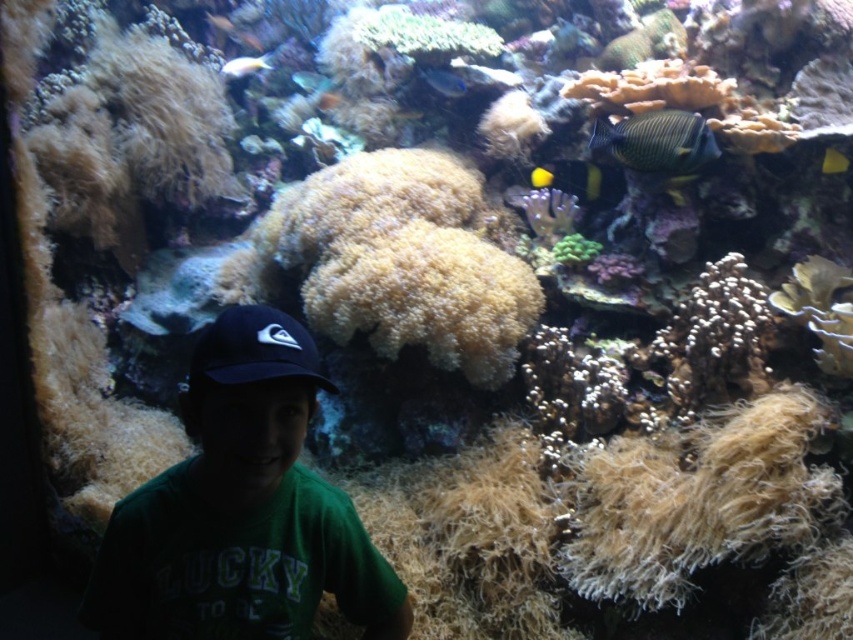
Between white soft coral at upper center and blue glossy fish at upper center, which one has less height?

blue glossy fish at upper center is shorter.

Who is more forward, (386, 48) or (448, 93)?

Point (386, 48) is in front.

Identify the location of white soft coral at upper center. (425, 35).

Consider the image. Can you confirm if green matte shirt at center is positioned to the right of shiny blue fish at upper center?

Indeed, green matte shirt at center is positioned on the right side of shiny blue fish at upper center.

Does green matte shirt at center appear on the left side of shiny blue fish at upper center?

Incorrect, green matte shirt at center is not on the left side of shiny blue fish at upper center.

Identify the location of green matte shirt at center. Image resolution: width=853 pixels, height=640 pixels. (241, 509).

Can you confirm if shiny blue fish at upper right is positioned to the right of shiny blue fish at upper center?

Yes, shiny blue fish at upper right is to the right of shiny blue fish at upper center.

Is shiny blue fish at upper right thinner than shiny blue fish at upper center?

No, shiny blue fish at upper right is not thinner than shiny blue fish at upper center.

Describe the element at coordinates (657, 140) in the screenshot. I see `shiny blue fish at upper right` at that location.

Identify the location of shiny blue fish at upper right. (657, 140).